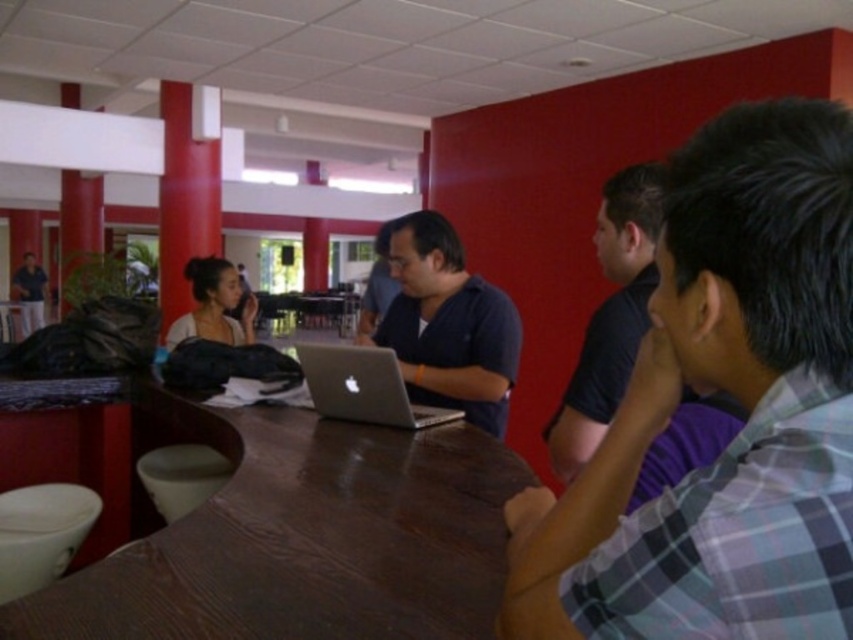
Is purple matte shirt at center thinner than matte black laptop at left?

Indeed, purple matte shirt at center has a lesser width compared to matte black laptop at left.

Is purple matte shirt at center to the right of matte black laptop at left from the viewer's perspective?

Yes, purple matte shirt at center is to the right of matte black laptop at left.

Is point (643, 301) farther from camera compared to point (22, 308)?

No, (643, 301) is closer to viewer.

I want to click on purple matte shirt at center, so pyautogui.click(x=610, y=316).

Does point (762, 560) come in front of point (202, 260)?

Yes.

Is plaid shirt at center closer to the viewer compared to matte white hair at upper left?

Yes.

Describe the element at coordinates (732, 394) in the screenshot. The width and height of the screenshot is (853, 640). I see `plaid shirt at center` at that location.

I want to click on plaid shirt at center, so click(x=732, y=394).

Who is lower down, silver metallic laptop at center or matte white hair at upper left?

silver metallic laptop at center

Is silver metallic laptop at center wider than matte white hair at upper left?

In fact, silver metallic laptop at center might be narrower than matte white hair at upper left.

Between point (332, 417) and point (199, 308), which one is positioned in front?

Point (332, 417) is more forward.

The width and height of the screenshot is (853, 640). What are the coordinates of `silver metallic laptop at center` in the screenshot? It's located at (363, 387).